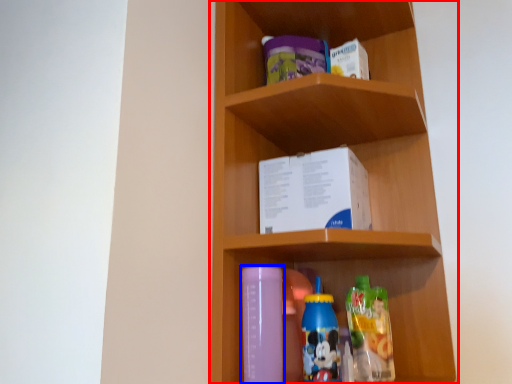
Question: Which object is closer to the camera taking this photo, shelf (highlighted by a red box) or bottle (highlighted by a blue box)?

Choices:
 (A) shelf
 (B) bottle

Answer: (A)